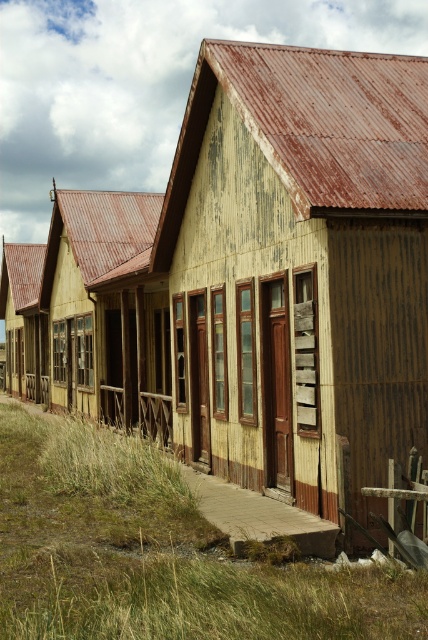
Question: Which of these objects is positioned closest to the weathered wood hut at center?

Choices:
 (A) green grass at lower left
 (B) wooden planks hut at center

Answer: (A)

Question: Based on their relative distances, which object is farther from the wooden planks hut at center?

Choices:
 (A) weathered wood hut at center
 (B) green grass at lower left

Answer: (B)

Question: Is green grass at lower left positioned behind wooden planks hut at center?

Choices:
 (A) no
 (B) yes

Answer: (A)

Question: Which is farther from the wooden planks hut at center?

Choices:
 (A) green grass at lower left
 (B) weathered wood hut at center

Answer: (A)

Question: Does weathered wood hut at center come in front of wooden planks hut at center?

Choices:
 (A) yes
 (B) no

Answer: (A)

Question: Can you confirm if weathered wood hut at center is smaller than green grass at lower left?

Choices:
 (A) yes
 (B) no

Answer: (B)